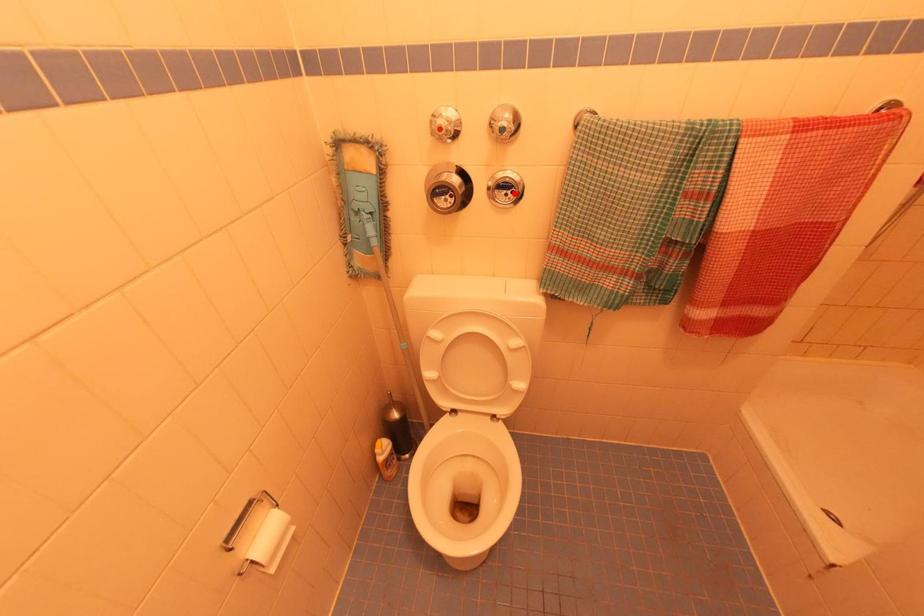
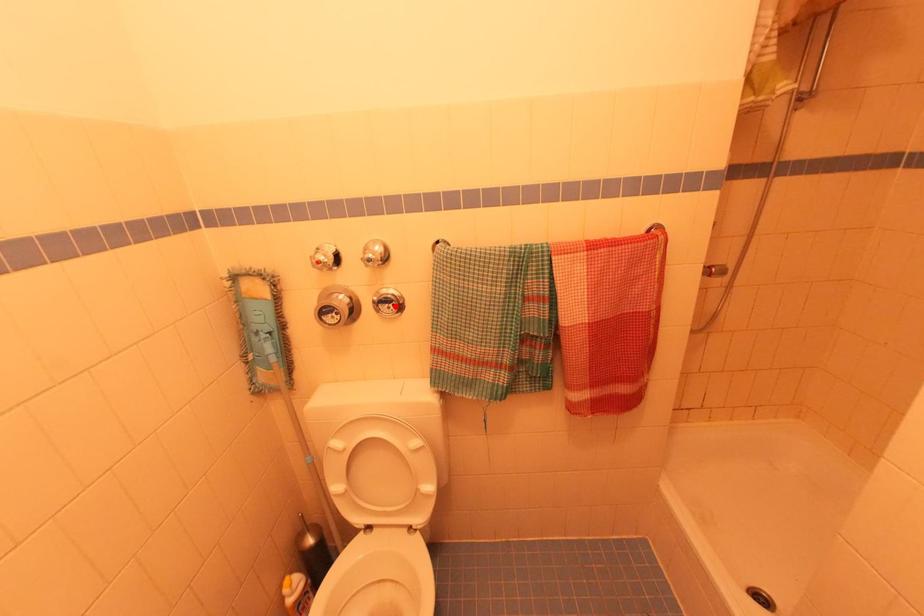
I am providing you with two images of the same scene from different viewpoints. A red point is marked on the first image and another point is marked on the second image. Is the red point in image1 aligned with the point shown in image2?

Yes